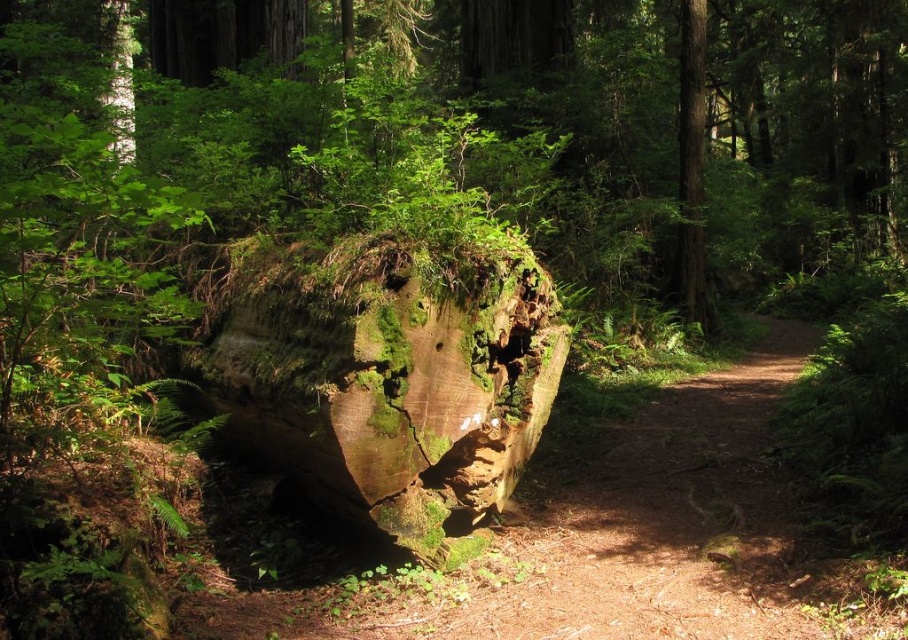
You are a hiker standing in the forest and want to touch both the green mossy wood at center and the smooth brown tree trunk at center. Which object will you reach first?

The green mossy wood at center is closer to the viewer than the smooth brown tree trunk at center, so you will reach the green mossy wood at center first.

You are a botanist studying the forest floor. You need to locate the green mossy wood at center. According to the coordinates provided, where would you find it?

The green mossy wood at center is located at coordinates point (381, 378).

You are a hiker who wants to place a small picnic basket on the largest available surface in the scene. Based on the image, which object should you choose between the green mossy wood at center and the smooth brown tree trunk at center?

The green mossy wood at center is larger in size than the smooth brown tree trunk at center, so you should choose the green mossy wood at center to place your picnic basket.